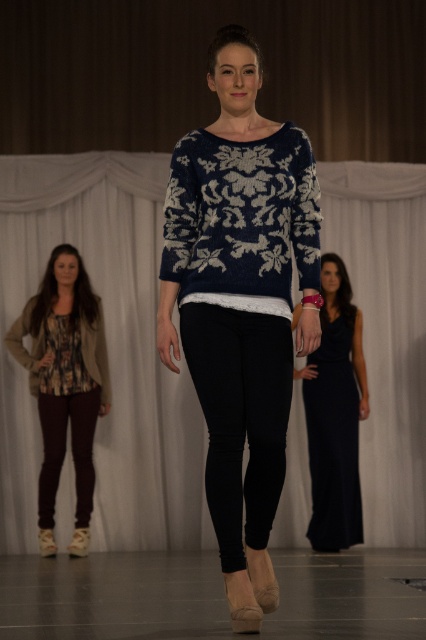
Question: Is printed fabric blouse at left to the right of floral print jersey at lower left from the viewer's perspective?

Choices:
 (A) yes
 (B) no

Answer: (B)

Question: Can you confirm if navy knit sweater at center is wider than floral print jersey at lower left?

Choices:
 (A) no
 (B) yes

Answer: (B)

Question: Which of the following is the closest to the observer?

Choices:
 (A) (279, 259)
 (B) (308, 145)
 (C) (78, 358)

Answer: (A)

Question: Which point is closer to the camera?

Choices:
 (A) (40, 387)
 (B) (219, 548)
 (C) (25, 348)

Answer: (B)

Question: Can you confirm if navy knit sweater at center is positioned to the right of velvet black dress at right?

Choices:
 (A) no
 (B) yes

Answer: (A)

Question: Which is nearer to the navy knit sweater at center?

Choices:
 (A) velvet black dress at right
 (B) printed fabric blouse at left

Answer: (A)